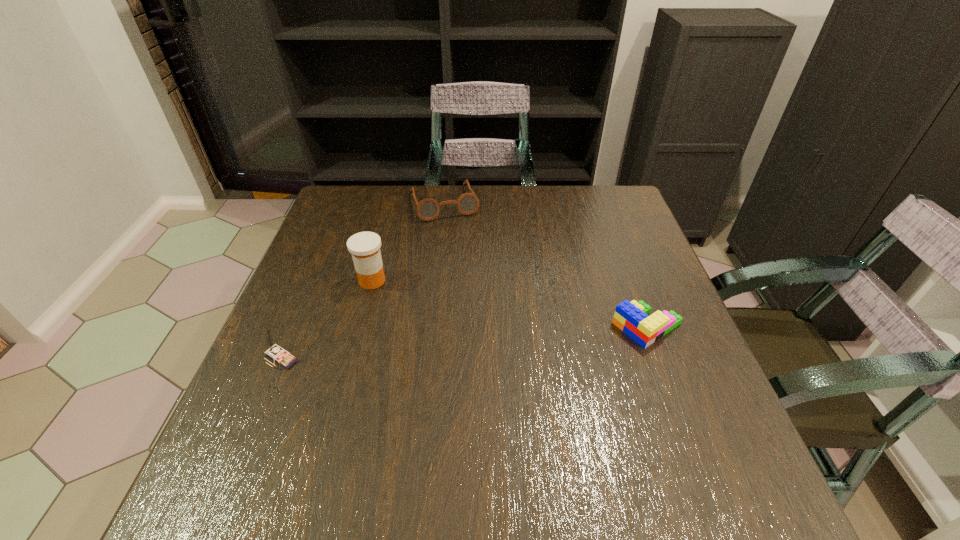
At what (x,y) coordinates should I click in order to perform the action: click on vacant area at the near edge. Please return your answer as a coordinate pair (x, y). This screenshot has height=540, width=960. Looking at the image, I should click on (456, 413).

Locate an element on the screen. The image size is (960, 540). blank space at the left edge of the desktop is located at coordinates (297, 274).

Image resolution: width=960 pixels, height=540 pixels. Identify the location of vacant area at the right edge of the desktop. (654, 279).

This screenshot has width=960, height=540. In the image, there is a desktop. What are the coordinates of `vacant space at the far right corner` in the screenshot? It's located at (596, 198).

This screenshot has width=960, height=540. In the image, there is a desktop. In order to click on free space at the near right corner in this screenshot , I will do `click(666, 410)`.

At what (x,y) coordinates should I click in order to perform the action: click on free spot between the Lego and the matchbox. Please return your answer as a coordinate pair (x, y). Looking at the image, I should click on (465, 342).

Identify the location of free area in between the matchbox and the shortest object. The width and height of the screenshot is (960, 540). (465, 342).

Where is `free spot between the third tallest object and the third object from right to left`? free spot between the third tallest object and the third object from right to left is located at coordinates (408, 241).

In order to click on vacant area between the matchbox and the Lego in this screenshot , I will do `click(465, 342)`.

You are a GUI agent. You are given a task and a screenshot of the screen. Output one action in this format:
    pyautogui.click(x=<x>, y=<y>)
    Task: Click on the free spot between the leftmost object and the third nearest object
    The height and width of the screenshot is (540, 960).
    Given the screenshot: What is the action you would take?
    [327, 319]